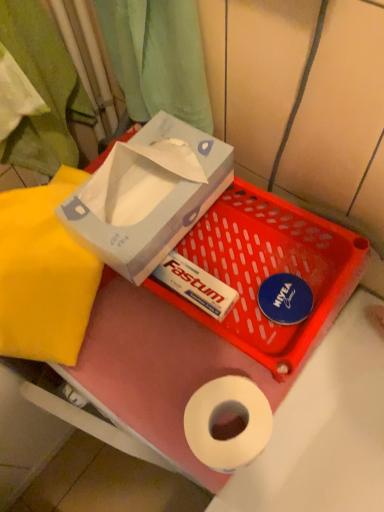
Where is `green fabric curtain at upper left`? The width and height of the screenshot is (384, 512). green fabric curtain at upper left is located at coordinates (158, 58).

I want to click on white cardboard box at upper center, positioned as the first box in bottom-to-top order, so click(214, 320).

The width and height of the screenshot is (384, 512). What are the coordinates of `green fabric curtain at upper left` in the screenshot? It's located at (158, 58).

Is the depth of white cardboard box at upper center, the second box in the top-to-bottom sequence, greater than that of white cardboard box at upper left, which is the 1th box from top to bottom?

Yes, the depth of white cardboard box at upper center, the second box in the top-to-bottom sequence, is greater than that of white cardboard box at upper left, which is the 1th box from top to bottom.

From the image's perspective, which is below, white cardboard box at upper center, positioned as the first box in bottom-to-top order, or white cardboard box at upper left, the 2th box from the bottom?

white cardboard box at upper center, positioned as the first box in bottom-to-top order, from the image's perspective.

Based on their sizes in the image, would you say white cardboard box at upper center, positioned as the first box in bottom-to-top order, is bigger or smaller than white cardboard box at upper left, which is the 1th box from top to bottom?

Clearly, white cardboard box at upper center, positioned as the first box in bottom-to-top order, is smaller in size than white cardboard box at upper left, which is the 1th box from top to bottom.

How different are the orientations of white cardboard box at upper center, the second box in the top-to-bottom sequence, and white cardboard box at upper left, which is the 1th box from top to bottom, in degrees?

There is a 0.887-degree angle between the facing directions of white cardboard box at upper center, the second box in the top-to-bottom sequence, and white cardboard box at upper left, which is the 1th box from top to bottom.

From the image's perspective, is white cardboard box at upper center, the second box in the top-to-bottom sequence, located above yellow fabric at left?

No.

Considering the relative sizes of white cardboard box at upper center, positioned as the first box in bottom-to-top order, and yellow fabric at left in the image provided, is white cardboard box at upper center, positioned as the first box in bottom-to-top order, taller than yellow fabric at left?

In fact, white cardboard box at upper center, positioned as the first box in bottom-to-top order, may be shorter than yellow fabric at left.

Which is more to the left, white cardboard box at upper center, the second box in the top-to-bottom sequence, or yellow fabric at left?

A: From the viewer's perspective, yellow fabric at left appears more on the left side.

From the picture: What's the angular difference between white cardboard box at upper left, which is the 1th box from top to bottom, and green fabric curtain at upper left's facing directions?

white cardboard box at upper left, which is the 1th box from top to bottom, and green fabric curtain at upper left are facing 0.883 degrees away from each other.

Looking at this image, can you confirm if white cardboard box at upper left, the 2th box from the bottom, is positioned to the right of green fabric curtain at upper left?

Yes, white cardboard box at upper left, the 2th box from the bottom, is to the right of green fabric curtain at upper left.

Based on the photo, from a real-world perspective, is white cardboard box at upper left, which is the 1th box from top to bottom, located beneath green fabric curtain at upper left?

Yes, from a real-world perspective, white cardboard box at upper left, which is the 1th box from top to bottom, is below green fabric curtain at upper left.

Which is behind, point (184, 158) or point (123, 326)?

The point (123, 326) is farther.

Considering the relative sizes of white cardboard box at upper left, which is the 1th box from top to bottom, and white cardboard box at upper center, positioned as the first box in bottom-to-top order, in the image provided, is white cardboard box at upper left, which is the 1th box from top to bottom, shorter than white cardboard box at upper center, positioned as the first box in bottom-to-top order,?

No.

Image resolution: width=384 pixels, height=512 pixels. Identify the location of box that is on the left side of white cardboard box at upper center, positioned as the first box in bottom-to-top order. (148, 195).

How many degrees apart are the facing directions of white cardboard box at upper left, the 2th box from the bottom, and yellow fabric at left?

The facing directions of white cardboard box at upper left, the 2th box from the bottom, and yellow fabric at left are 24.4 degrees apart.

Looking at the image, does white cardboard box at upper left, the 2th box from the bottom, seem bigger or smaller compared to yellow fabric at left?

white cardboard box at upper left, the 2th box from the bottom, is smaller than yellow fabric at left.

Would you say white cardboard box at upper left, which is the 1th box from top to bottom, is outside yellow fabric at left?

Yes, white cardboard box at upper left, which is the 1th box from top to bottom, is not within yellow fabric at left.

Considering the sizes of objects white cardboard box at upper left, the 2th box from the bottom, and yellow fabric at left in the image provided, who is taller, white cardboard box at upper left, the 2th box from the bottom, or yellow fabric at left?

white cardboard box at upper left, the 2th box from the bottom, is taller.

What's the angular difference between green fabric curtain at upper left and white cardboard box at upper center, positioned as the first box in bottom-to-top order,'s facing directions?

The angular difference between green fabric curtain at upper left and white cardboard box at upper center, positioned as the first box in bottom-to-top order, is 0.00715 degrees.

Is green fabric curtain at upper left to the left of white cardboard box at upper center, positioned as the first box in bottom-to-top order, from the viewer's perspective?

Indeed, green fabric curtain at upper left is positioned on the left side of white cardboard box at upper center, positioned as the first box in bottom-to-top order.

Is the position of green fabric curtain at upper left more distant than that of white cardboard box at upper center, the second box in the top-to-bottom sequence?

No, it is not.

You are a GUI agent. You are given a task and a screenshot of the screen. Output one action in this format:
    pyautogui.click(x=<x>, y=<y>)
    Task: Click on the curtain on the left of white cardboard box at upper center, positioned as the first box in bottom-to-top order
    Image resolution: width=384 pixels, height=512 pixels.
    Given the screenshot: What is the action you would take?
    pyautogui.click(x=158, y=58)

Image resolution: width=384 pixels, height=512 pixels. What are the coordinates of `box located in front of the green fabric curtain at upper left` in the screenshot? It's located at (148, 195).

Are green fabric curtain at upper left and white cardboard box at upper left, the 2th box from the bottom, located far from each other?

No, there isn't a large distance between green fabric curtain at upper left and white cardboard box at upper left, the 2th box from the bottom.

Considering the relative sizes of green fabric curtain at upper left and white cardboard box at upper left, the 2th box from the bottom, in the image provided, is green fabric curtain at upper left thinner than white cardboard box at upper left, the 2th box from the bottom,?

Correct, the width of green fabric curtain at upper left is less than that of white cardboard box at upper left, the 2th box from the bottom.

Find the location of a particular element. Image resolution: width=384 pixels, height=512 pixels. box located below the white cardboard box at upper left, the 2th box from the bottom (from the image's perspective) is located at coordinates (214, 320).

The width and height of the screenshot is (384, 512). I want to click on cloth behind the white cardboard box at upper center, the second box in the top-to-bottom sequence, so click(x=44, y=274).

From the picture: Looking at the image, which one is located closer to green fabric curtain at upper left, white cardboard box at upper left, which is the 1th box from top to bottom, or white cardboard box at upper center, positioned as the first box in bottom-to-top order?

white cardboard box at upper left, which is the 1th box from top to bottom, lies closer to green fabric curtain at upper left than the other object.

Looking at the image, which one is located further to white cardboard box at upper center, positioned as the first box in bottom-to-top order, green fabric curtain at upper left or yellow fabric at left?

The object further to white cardboard box at upper center, positioned as the first box in bottom-to-top order, is green fabric curtain at upper left.

From the image, which object appears to be farther from yellow fabric at left, green fabric curtain at upper left or white cardboard box at upper center, the second box in the top-to-bottom sequence?

green fabric curtain at upper left lies further to yellow fabric at left than the other object.

Which object lies nearer to the anchor point green fabric curtain at upper left, yellow fabric at left or white cardboard box at upper left, the 2th box from the bottom?

The object closer to green fabric curtain at upper left is white cardboard box at upper left, the 2th box from the bottom.

When comparing their distances from yellow fabric at left, does white cardboard box at upper left, the 2th box from the bottom, or white cardboard box at upper center, the second box in the top-to-bottom sequence, seem further?

Based on the image, white cardboard box at upper center, the second box in the top-to-bottom sequence, appears to be further to yellow fabric at left.

Looking at this image, considering their positions, is yellow fabric at left positioned closer to white cardboard box at upper center, positioned as the first box in bottom-to-top order, than green fabric curtain at upper left?

The object closer to white cardboard box at upper center, positioned as the first box in bottom-to-top order, is yellow fabric at left.

From the image, which object appears to be nearer to white cardboard box at upper left, which is the 1th box from top to bottom, yellow fabric at left or green fabric curtain at upper left?

Among the two, yellow fabric at left is located nearer to white cardboard box at upper left, which is the 1th box from top to bottom.

From the image, which object appears to be farther from white cardboard box at upper left, which is the 1th box from top to bottom, yellow fabric at left or white cardboard box at upper center, the second box in the top-to-bottom sequence?

Based on the image, white cardboard box at upper center, the second box in the top-to-bottom sequence, appears to be further to white cardboard box at upper left, which is the 1th box from top to bottom.

You are a GUI agent. You are given a task and a screenshot of the screen. Output one action in this format:
    pyautogui.click(x=<x>, y=<y>)
    Task: Click on the box situated between yellow fabric at left and white cardboard box at upper center, the second box in the top-to-bottom sequence, from left to right
    The height and width of the screenshot is (512, 384).
    Given the screenshot: What is the action you would take?
    148,195

You are a GUI agent. You are given a task and a screenshot of the screen. Output one action in this format:
    pyautogui.click(x=<x>, y=<y>)
    Task: Click on the box between green fabric curtain at upper left and white cardboard box at upper center, the second box in the top-to-bottom sequence, vertically
    
    Given the screenshot: What is the action you would take?
    pyautogui.click(x=148, y=195)

Where is `cloth between green fabric curtain at upper left and white cardboard box at upper center, the second box in the top-to-bottom sequence, in the vertical direction`? cloth between green fabric curtain at upper left and white cardboard box at upper center, the second box in the top-to-bottom sequence, in the vertical direction is located at coordinates (44, 274).

Where is `box between green fabric curtain at upper left and yellow fabric at left vertically`? box between green fabric curtain at upper left and yellow fabric at left vertically is located at coordinates (148, 195).